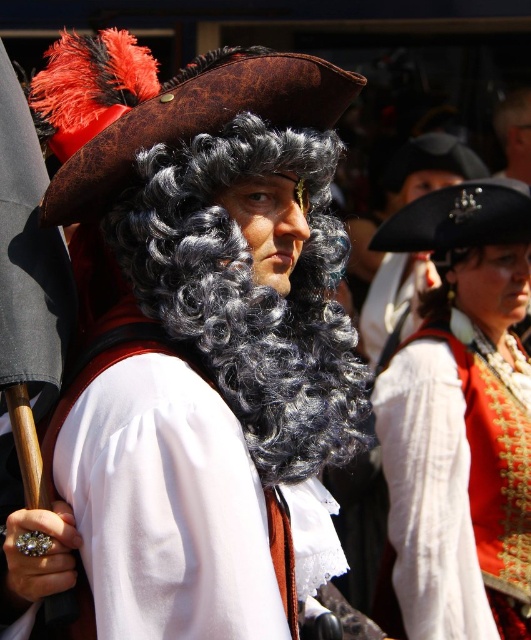
You are a costume designer preparing for a historical play. You need to ensure the placement of the white satin vest at center and the black curly wig at upper right matches the original design. According to the scene description, which item is positioned to the right of the other?

The white satin vest at center is to the right of the black curly wig at upper right.

You are a costume designer observing the historical reenactment scene. You need to determine the spatial relationship between the curly black wig at center and the black curly wig at upper right. Which wig is closer to the viewer?

The curly black wig at center is closer to the viewer than the black curly wig at upper right.

Based on the scene description, which object is shorter in height between the curly black wig at center and the white satin vest at center?

The curly black wig at center is shorter than the white satin vest at center.